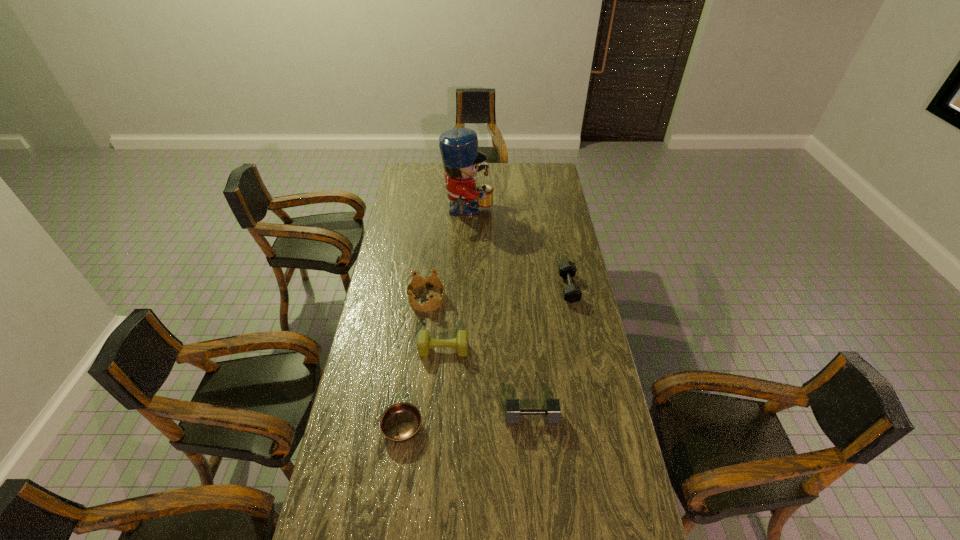
Locate an element on the screen. empty space between the second tallest object and the second dumbbell from right to left is located at coordinates (479, 357).

The height and width of the screenshot is (540, 960). Identify the location of vacant space that's between the rightmost object and the leftmost dumbbell. (506, 319).

Locate which object is the second closest to the shortest object. Please provide its 2D coordinates. Your answer should be formatted as a tuple, i.e. [(x, y)], where the tuple contains the x and y coordinates of a point satisfying the conditions above.

[(552, 411)]

Find the location of `object that stands as the fifth closest to the rightmost object`. object that stands as the fifth closest to the rightmost object is located at coordinates (400, 422).

Locate which dumbbell is the third closest to the shortest object. Please provide its 2D coordinates. Your answer should be formatted as a tuple, i.e. [(x, y)], where the tuple contains the x and y coordinates of a point satisfying the conditions above.

[(572, 293)]

At what (x,y) coordinates should I click in order to perform the action: click on dumbbell that stands as the closest to the shortest object. Please return your answer as a coordinate pair (x, y). Looking at the image, I should click on (425, 343).

Image resolution: width=960 pixels, height=540 pixels. Identify the location of blank area in the image that satisfies the following two spatial constraints: 1. on the front-facing side of the second object from right to left; 2. on the right side of the tiara. (412, 417).

At what (x,y) coordinates should I click in order to perform the action: click on free space that satisfies the following two spatial constraints: 1. on the front-facing side of the tiara; 2. on the back side of the nearest dumbbell. Please return your answer as a coordinate pair (x, y). This screenshot has width=960, height=540. Looking at the image, I should click on (412, 417).

Identify the location of free spot that satisfies the following two spatial constraints: 1. on the back side of the shortest object; 2. on the right side of the rightmost dumbbell. This screenshot has height=540, width=960. (421, 288).

At what (x,y) coordinates should I click in order to perform the action: click on free space that satisfies the following two spatial constraints: 1. on the front-facing side of the second dumbbell from left to right; 2. on the right side of the tiara. Please return your answer as a coordinate pair (x, y). Looking at the image, I should click on (412, 417).